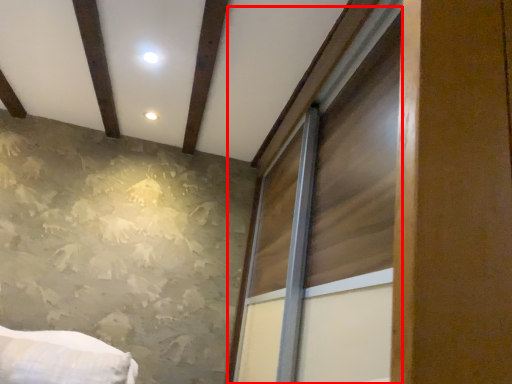
Question: From the image's perspective, what is the correct spatial positioning of window (annotated by the red box) in reference to plank?

Choices:
 (A) above
 (B) below

Answer: (B)